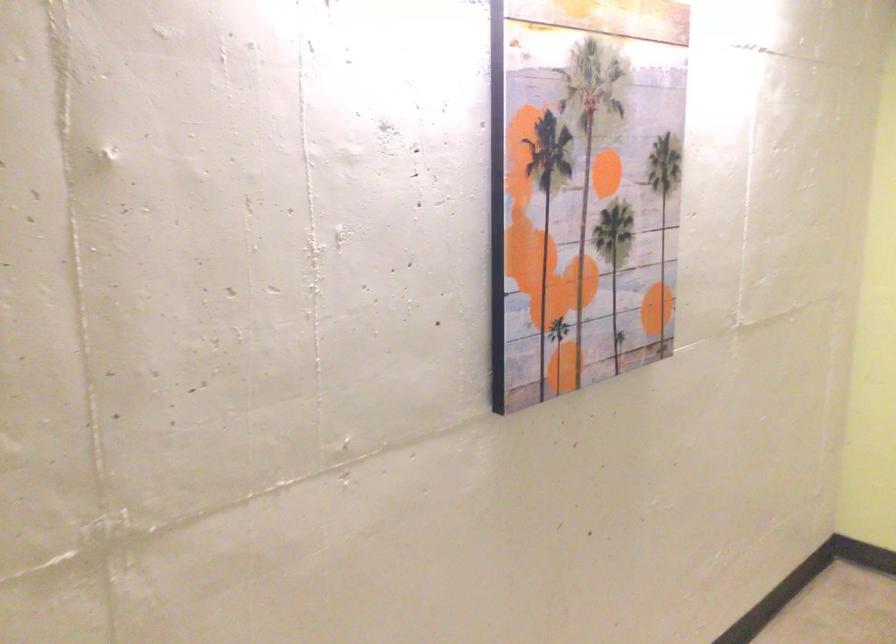
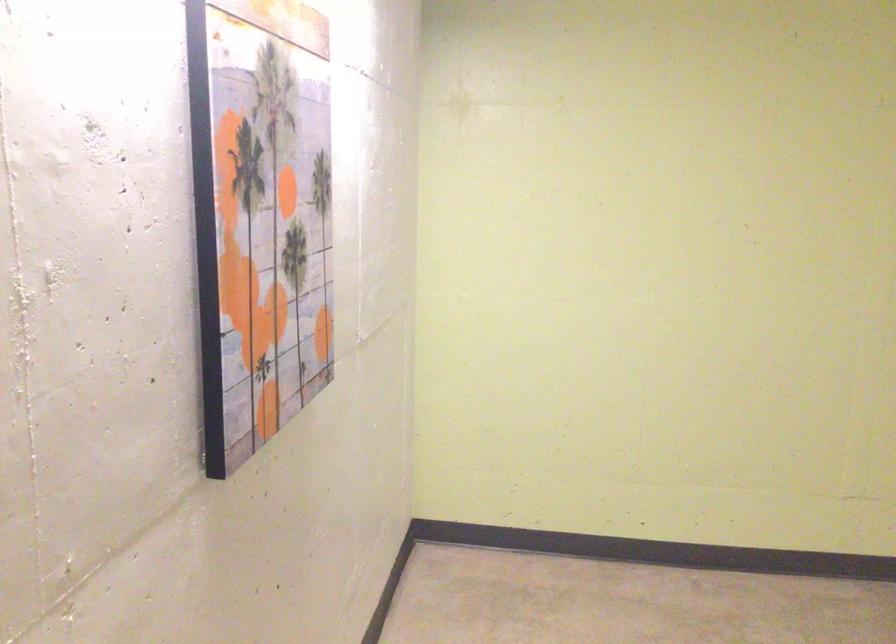
Question: The camera is either moving clockwise (left) or counter-clockwise (right) around the object. The first image is from the beginning of the video and the second image is from the end. Is the camera moving left or right when shooting the video?

Choices:
 (A) Left
 (B) Right

Answer: (A)